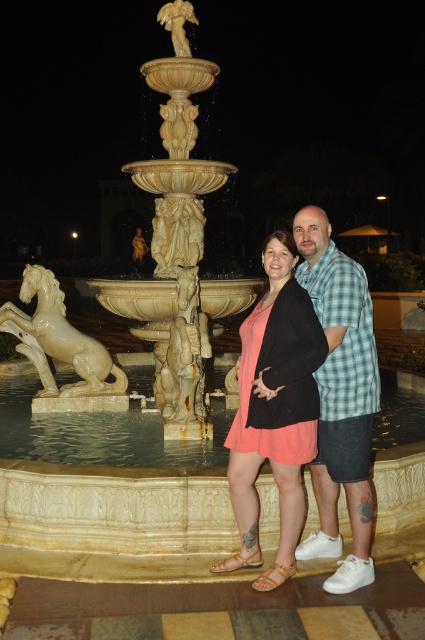
Does white glossy horse at left lie in front of gold marble statue at upper center?

Yes, it is.

Which is above, white glossy horse at left or gold marble statue at upper center?

Positioned higher is gold marble statue at upper center.

Identify the location of white glossy horse at left. Image resolution: width=425 pixels, height=640 pixels. (59, 339).

Which of these two, matte coral dress at center or checkered fabric shirt at center, stands taller?

With more height is checkered fabric shirt at center.

Find the location of a particular element. matte coral dress at center is located at coordinates (274, 410).

Is matte coral dress at center closer to the viewer compared to white glossy horse at left?

Yes, it is in front of white glossy horse at left.

Can you confirm if matte coral dress at center is shorter than white glossy horse at left?

No, matte coral dress at center is not shorter than white glossy horse at left.

Where is `matte coral dress at center`? This screenshot has width=425, height=640. matte coral dress at center is located at coordinates (274, 410).